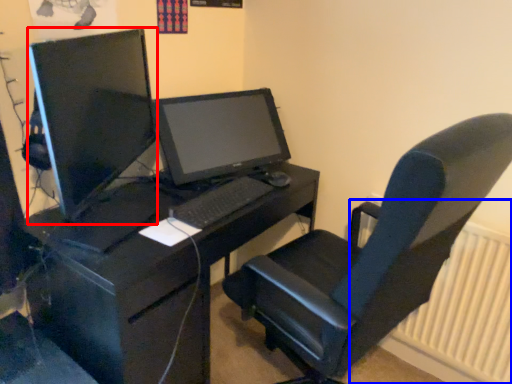
Question: Which object appears closest to the camera in this image, computer monitor (highlighted by a red box) or radiator (highlighted by a blue box)?

Choices:
 (A) computer monitor
 (B) radiator

Answer: (A)